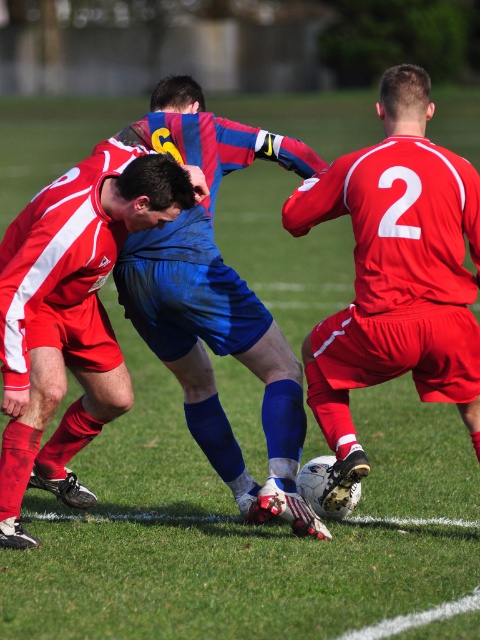
You are a photographer standing at the edge of the soccer field. You want to take a closeup photo of the blue fabric shirt at center. What is the minimum distance you need to move forward to get the shirt into focus if your camera has a minimum focusing distance of 4 meters?

The blue fabric shirt at center is currently 5.02 meters away from the camera. To get it within the camera minimum focusing distance of 4 meters, you need to move forward by 1.02 meters so that the distance becomes exactly 4 meters.

You are a soccer referee watching the match. You notice two blue fabric items at the center of the field. According to the rules, shirts must be longer than shorts to avoid exposure. Do the blue fabric shirt at center and blue fabric shorts at center comply with the rule?

The blue fabric shirt at center is shorter than blue fabric shorts at center, so it does not comply with the rule because the shirt is not longer than the shorts.

You are a soccer referee observing the match. You need to determine which player is closer to the ball. The ball is at the center of the field. The players are the matte red jersey at center and the blue fabric shirt at center. Which player is positioned closer to the ball?

Both the matte red jersey at center and the blue fabric shirt at center are positioned at the center of the field, so they are equally close to the ball.